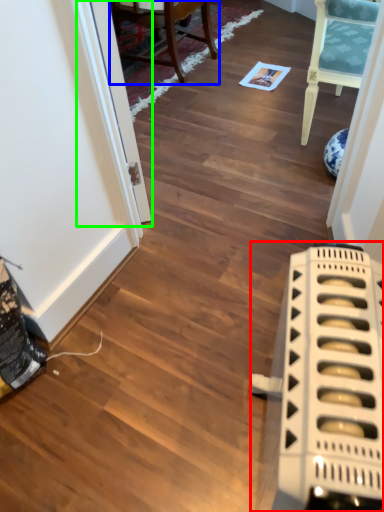
Question: Estimate the real-world distances between objects in this image. Which object is closer to appliance (highlighted by a red box), chair (highlighted by a blue box) or glass door (highlighted by a green box)?

Choices:
 (A) chair
 (B) glass door

Answer: (B)